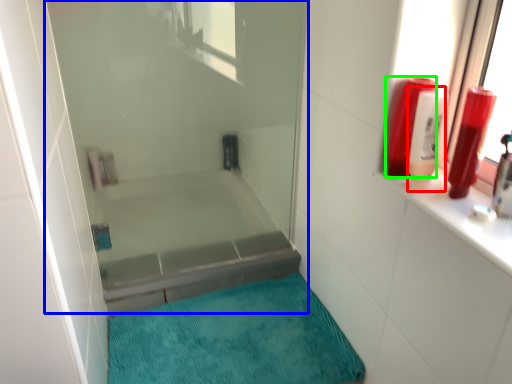
Question: Estimate the real-world distances between objects in this image. Which object is closer to toiletry (highlighted by a red box), shower door (highlighted by a blue box) or toiletry (highlighted by a green box)?

Choices:
 (A) shower door
 (B) toiletry

Answer: (B)